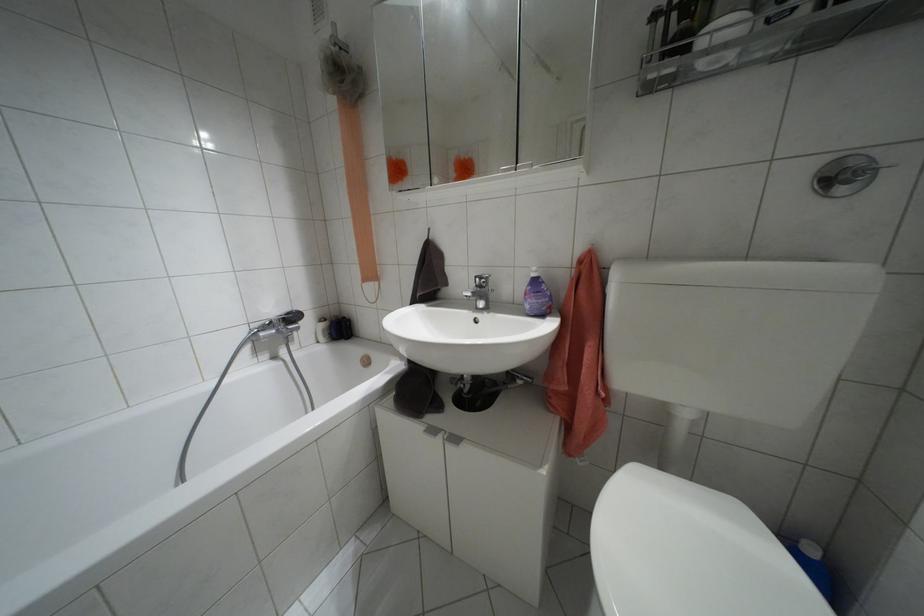
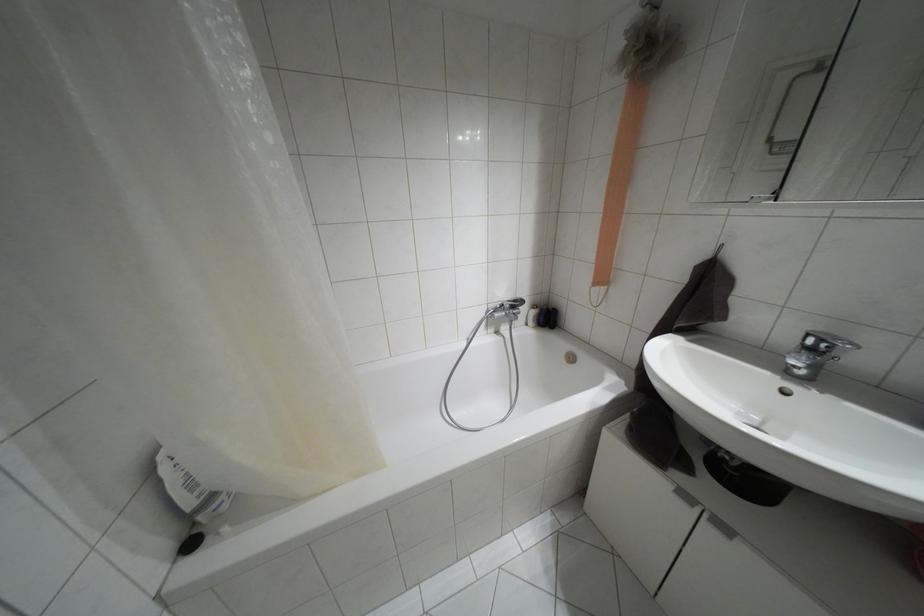
The point at [455,439] is marked in the first image. Where is the corresponding point in the second image?

(723, 528)